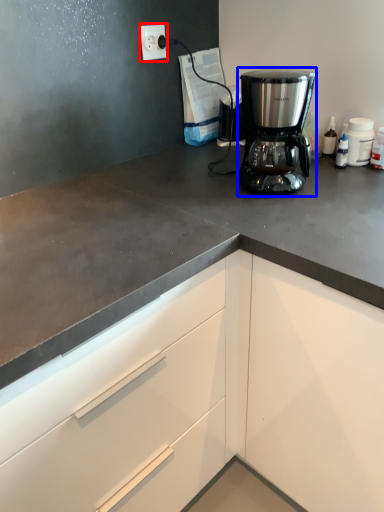
Question: Among these objects, which one is nearest to the camera, electric outlet (highlighted by a red box) or coffee maker (highlighted by a blue box)?

Choices:
 (A) electric outlet
 (B) coffee maker

Answer: (B)